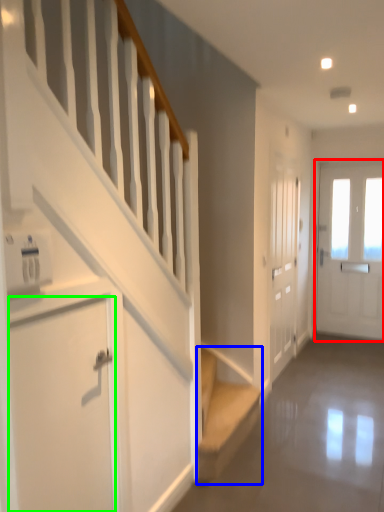
Question: Which object is positioned farthest from door (highlighted by a red box)? Select from stairs (highlighted by a blue box) and door (highlighted by a green box).

Choices:
 (A) stairs
 (B) door

Answer: (B)